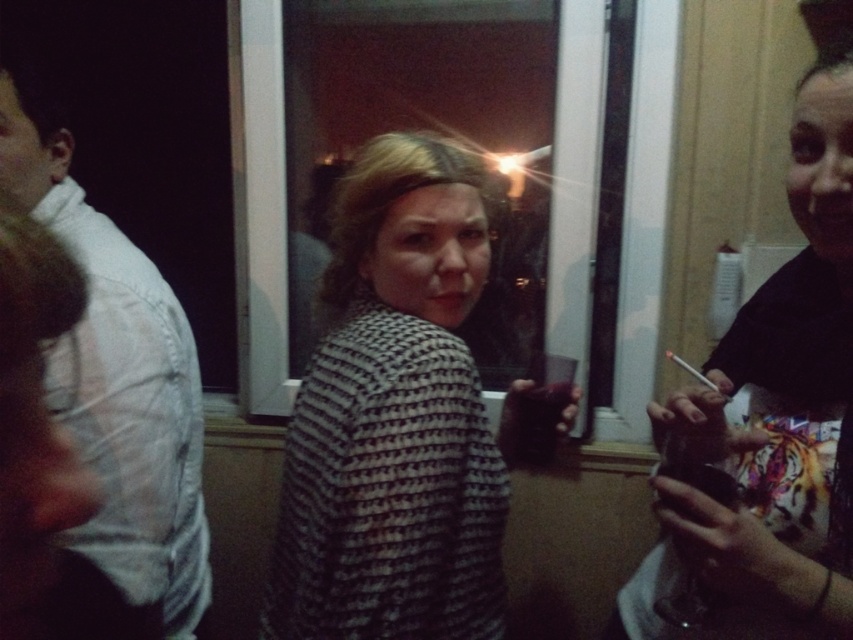
Question: Which point appears farthest from the camera in this image?

Choices:
 (A) click(292, 486)
 (B) click(131, 246)
 (C) click(705, 385)

Answer: (B)

Question: Is black matte shirt at right above white cotton shirt at left?

Choices:
 (A) yes
 (B) no

Answer: (B)

Question: Is black matte shirt at right to the left of matte white cigarette at center from the viewer's perspective?

Choices:
 (A) yes
 (B) no

Answer: (A)

Question: Which of the following is the closest to the observer?

Choices:
 (A) (320, 384)
 (B) (120, 433)
 (C) (816, 541)

Answer: (C)

Question: Among these objects, which one is nearest to the camera?

Choices:
 (A) matte white cigarette at center
 (B) white cotton shirt at left
 (C) patterned fabric sweater at center
 (D) black matte shirt at right

Answer: (D)

Question: Is patterned fabric sweater at center above white cotton shirt at left?

Choices:
 (A) yes
 (B) no

Answer: (B)